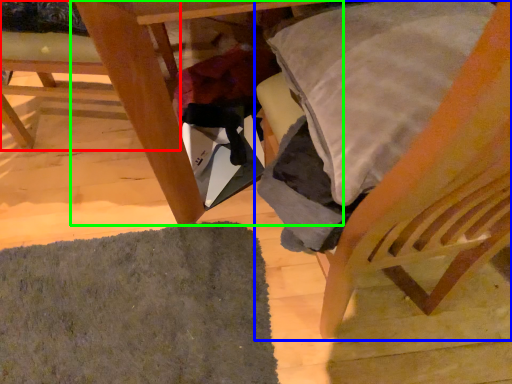
Question: Which is farther away from chair (highlighted by a red box)? chair (highlighted by a blue box) or table (highlighted by a green box)?

Choices:
 (A) chair
 (B) table

Answer: (A)